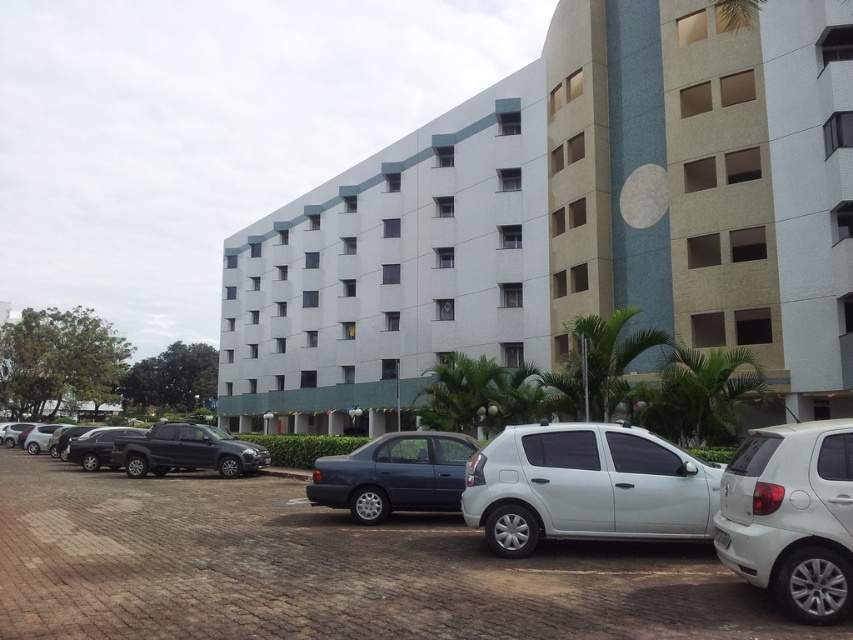
You are a delivery driver who needs to park your truck, which is as wide as the white matte hatchback at lower right. You want to park your truck next to the white smooth building at center. Can the truck fit in the space next to the building if the space is as wide as the building?

The white smooth building at center is wider than the white matte hatchback at lower right, so the truck, which is as wide as the hatchback, can fit in the space next to the building since the building is wider than the truck.

You are a parking attendant and need to fit a new car that is 1.8 meters wide into the parking spot between the white matte car at lower right and the matte black sedan at left. Can the new car fit there?

The white matte car at lower right is wider than the matte black sedan at left. Since the new car is 1.8 meters wide, we need to check if the space between them can accommodate this width. However, without knowing the exact distance between the cars, we cannot confirm if the new car will fit. Please measure the available space before deciding.

Consider the image. You are standing at the entrance of the multi story building and want to walk to the point marked as point (834, 557). There is an obstacle at point (338, 428). Will you have to go around the obstacle to reach your destination?

Since point (338, 428) is behind point (834, 557), you will not encounter the obstacle at point (338, 428) on your way to point (834, 557). You can proceed directly without needing to go around.